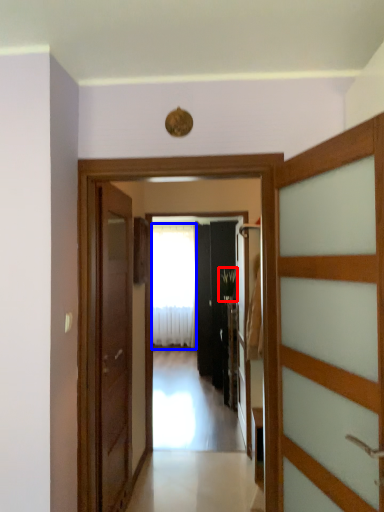
Question: Which of the following is the farthest to the observer, plant (highlighted by a red box) or curtain (highlighted by a blue box)?

Choices:
 (A) plant
 (B) curtain

Answer: (B)